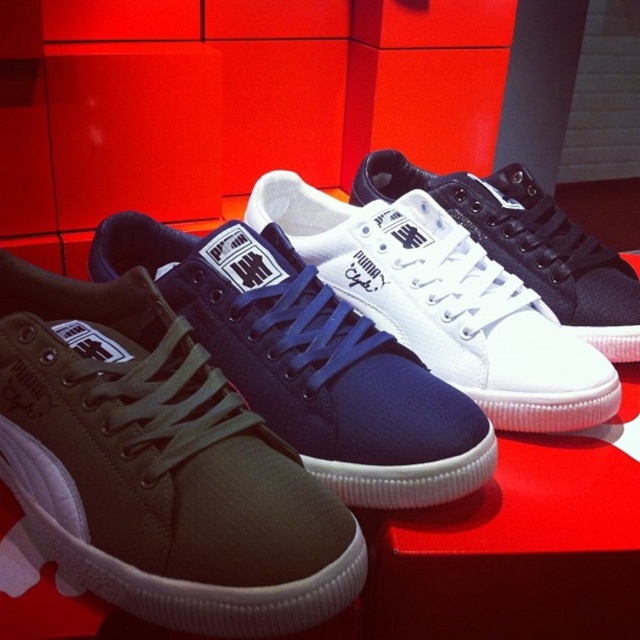
Question: Which of the following is the closest to the observer?

Choices:
 (A) olive canvas sneaker at center
 (B) navy blue canvas shoe at center
 (C) olive green canvas sneaker at center
 (D) white canvas sneaker at center

Answer: (C)

Question: Where is olive canvas sneaker at center located in relation to white canvas sneaker at center in the image?

Choices:
 (A) right
 (B) left

Answer: (B)

Question: Which object appears closest to the camera in this image?

Choices:
 (A) olive canvas sneaker at center
 (B) white canvas sneaker at center
 (C) olive green canvas sneaker at center
 (D) navy blue canvas shoe at center

Answer: (C)

Question: Among these points, which one is nearest to the camera?

Choices:
 (A) (522, 225)
 (B) (419, 237)
 (C) (19, 310)
 (D) (230, 371)

Answer: (D)

Question: In this image, where is olive green canvas sneaker at center located relative to white canvas sneaker at center?

Choices:
 (A) below
 (B) above

Answer: (A)

Question: Is olive green canvas sneaker at center to the left of white canvas sneaker at center from the viewer's perspective?

Choices:
 (A) yes
 (B) no

Answer: (A)